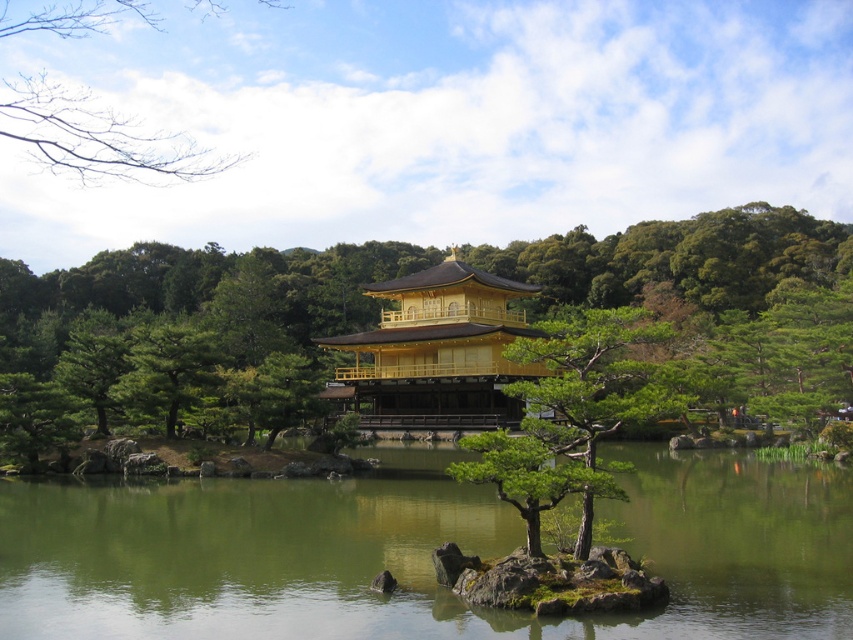
Question: Can you confirm if green glossy tree at center is positioned below bare branches at upper left?

Choices:
 (A) no
 (B) yes

Answer: (B)

Question: Can you confirm if golden polished wood temple at center is thinner than green glossy tree at center?

Choices:
 (A) no
 (B) yes

Answer: (A)

Question: Which is farther from the green liquid water at center?

Choices:
 (A) golden polished wood temple at center
 (B) green leafy tree at center
 (C) bare branches at upper left

Answer: (C)

Question: Which of the following is the farthest from the observer?

Choices:
 (A) bare branches at upper left
 (B) green leafy tree at center
 (C) green glossy tree at center

Answer: (A)

Question: Which is farther from the green leafy tree at center?

Choices:
 (A) green liquid water at center
 (B) green glossy tree at center
 (C) golden polished wood temple at center
 (D) bare branches at upper left

Answer: (A)

Question: In this image, where is green leafy tree at center located relative to bare branches at upper left?

Choices:
 (A) above
 (B) below

Answer: (B)